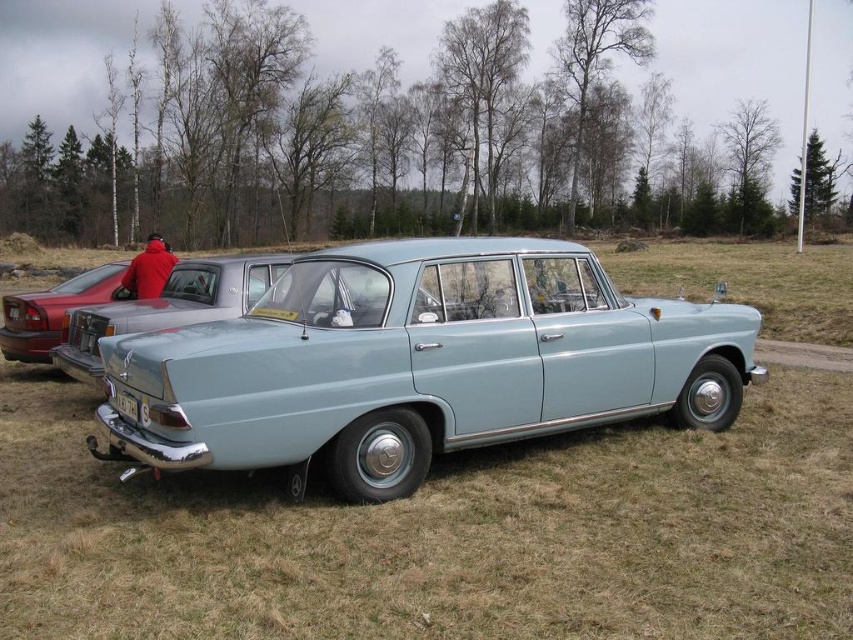
You are a delivery person needing to place a package between the matte black car at left and the red fabric jacket at rear. The package requires 9 feet of space. Can you fit it between them?

The distance between the matte black car at left and the red fabric jacket at rear is 8.74 feet, which is less than the required 9 feet. Therefore, the package cannot be placed between them.

You are a photographer planning to take a picture of the light blue matte sedan at center and the red fabric jacket at rear. Which object should you focus on first if you want to capture both in the same frame with maximum clarity?

The light blue matte sedan at center has a smaller size compared to red fabric jacket at rear, so you should focus on the light blue matte sedan at center first to ensure both are in focus since it is closer to the camera.

You are a delivery person who needs to place a large package between the light blue matte sedan at center and the red fabric jacket at rear. The package requires 8 feet of space. Can you fit it between them?

The distance between the light blue matte sedan at center and the red fabric jacket at rear is 7.77 feet, so the package requiring 8 feet of space cannot fit between them.